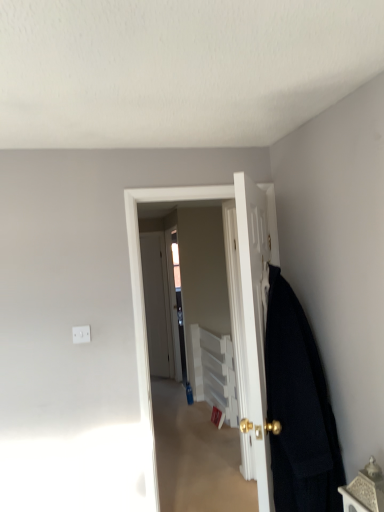
Question: In terms of width, does white glossy door at center, which is the second door in back-to-front order, look wider or thinner when compared to dark woolen blanket at right?

Choices:
 (A) thin
 (B) wide

Answer: (A)

Question: Based on their positions, is white glossy door at center, which is the first door from front to back, located to the left or right of dark woolen blanket at right?

Choices:
 (A) left
 (B) right

Answer: (A)

Question: Estimate the real-world distances between objects in this image. Which object is closer to the white glossy door at center, which appears as the 2th door when viewed from the front?

Choices:
 (A) metallic textured box at lower right
 (B) dark woolen blanket at right
 (C) white glossy door at center, which is the first door from front to back
 (D) white plastic cabinet at center
 (E) clear glass screen door at center

Answer: (C)

Question: Estimate the real-world distances between objects in this image. Which object is closer to the metallic textured box at lower right?

Choices:
 (A) dark woolen blanket at right
 (B) white glossy door at center, which appears as the 2th door when viewed from the front
 (C) clear glass screen door at center
 (D) white glossy door at center, which is the first door from front to back
 (E) white plastic cabinet at center

Answer: (A)